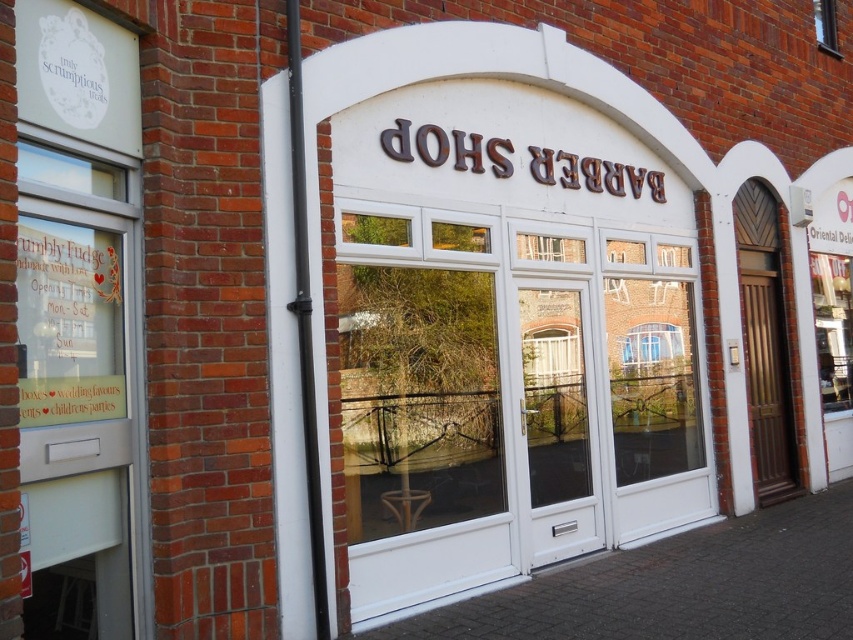
Is point (764, 472) closer to viewer compared to point (816, 29)?

Yes.

Can you confirm if brown wooden door at right is thinner than transparent glass window at upper right?

No, brown wooden door at right is not thinner than transparent glass window at upper right.

Who is more forward, (782, 388) or (828, 44)?

Positioned in front is point (782, 388).

This screenshot has width=853, height=640. Identify the location of brown wooden door at right. (766, 371).